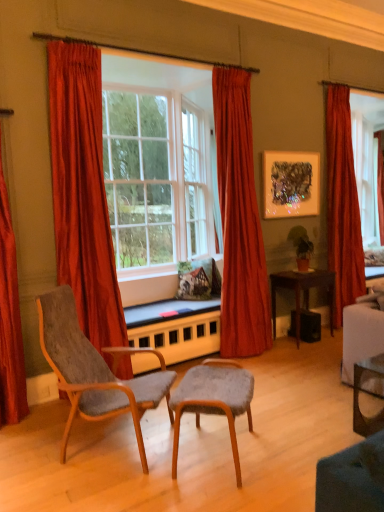
This screenshot has height=512, width=384. I want to click on clear glass window at center, so click(158, 163).

How much space does velvet red curtain at center, placed as the second curtain when sorted from right to left, occupy vertically?

9.21 feet.

Locate an element on the screen. velvet red curtain at left, the third curtain in the right-to-left sequence is located at coordinates (82, 192).

Measure the distance between velvet red curtain at left, the third curtain in the right-to-left sequence, and camera.

The distance of velvet red curtain at left, the third curtain in the right-to-left sequence, from camera is 3.09 meters.

This screenshot has width=384, height=512. What are the coordinates of `metallic textured artwork at upper right` in the screenshot? It's located at (291, 184).

How much space does satin red curtain at left, which ranks as the 1th curtain in left-to-right order, occupy vertically?

It is 7.36 feet.

Locate an element on the screen. Image resolution: width=384 pixels, height=512 pixels. green matte houseplant at upper right is located at coordinates (301, 246).

From their relative heights in the image, would you say velvet grey stool at center, placed as the 1th chair when sorted from right to left, is taller or shorter than velvet red curtain at left, the second curtain viewed from the left?

Clearly, velvet grey stool at center, placed as the 1th chair when sorted from right to left, is shorter compared to velvet red curtain at left, the second curtain viewed from the left.

Considering the relative sizes of velvet grey stool at center, arranged as the second chair when viewed from the left, and velvet red curtain at left, the second curtain viewed from the left, in the image provided, is velvet grey stool at center, arranged as the second chair when viewed from the left, thinner than velvet red curtain at left, the second curtain viewed from the left,?

No, velvet grey stool at center, arranged as the second chair when viewed from the left, is not thinner than velvet red curtain at left, the second curtain viewed from the left.

Does point (179, 383) come behind point (72, 147)?

No, it is in front of (72, 147).

Can we say velvet grey stool at center, arranged as the second chair when viewed from the left, lies outside velvet red curtain at left, the second curtain viewed from the left?

Yes.

Which is more to the right, velvet red curtain at left, the second curtain viewed from the left, or velvet grey stool at center, arranged as the second chair when viewed from the left?

From the viewer's perspective, velvet grey stool at center, arranged as the second chair when viewed from the left, appears more on the right side.

From a real-world perspective, who is located higher, velvet red curtain at left, the third curtain in the right-to-left sequence, or velvet grey stool at center, arranged as the second chair when viewed from the left?

velvet red curtain at left, the third curtain in the right-to-left sequence, is physically above.

In the scene shown: Is velvet red curtain at left, the third curtain in the right-to-left sequence, positioned beyond the bounds of velvet grey stool at center, placed as the 1th chair when sorted from right to left?

Yes, velvet red curtain at left, the third curtain in the right-to-left sequence, is outside of velvet grey stool at center, placed as the 1th chair when sorted from right to left.

Could you tell me if velvet red curtain at left, the third curtain in the right-to-left sequence, is turned towards velvet grey stool at center, arranged as the second chair when viewed from the left?

Yes, velvet red curtain at left, the third curtain in the right-to-left sequence, faces towards velvet grey stool at center, arranged as the second chair when viewed from the left.

Between velvet red curtain at center, arranged as the third curtain when viewed from the left, and velvet grey stool at center, arranged as the second chair when viewed from the left, which one is positioned behind?

velvet red curtain at center, arranged as the third curtain when viewed from the left.

Can you confirm if velvet red curtain at center, placed as the second curtain when sorted from right to left, is wider than velvet grey stool at center, arranged as the second chair when viewed from the left?

No, velvet red curtain at center, placed as the second curtain when sorted from right to left, is not wider than velvet grey stool at center, arranged as the second chair when viewed from the left.

Which is more to the left, velvet red curtain at center, arranged as the third curtain when viewed from the left, or velvet grey stool at center, arranged as the second chair when viewed from the left?

velvet grey stool at center, arranged as the second chair when viewed from the left.

Is there a large distance between velvet red curtain at center, placed as the second curtain when sorted from right to left, and velvet grey stool at center, arranged as the second chair when viewed from the left?

velvet red curtain at center, placed as the second curtain when sorted from right to left, is positioned a significant distance from velvet grey stool at center, arranged as the second chair when viewed from the left.

Is velvet red curtain at left, the third curtain in the right-to-left sequence, surrounded by velvet red curtain at right, which ranks as the fourth curtain in left-to-right order?

No, velvet red curtain at left, the third curtain in the right-to-left sequence, is not surrounded by velvet red curtain at right, which ranks as the fourth curtain in left-to-right order.

Can you confirm if velvet red curtain at right, which ranks as the fourth curtain in left-to-right order, is taller than velvet red curtain at left, the second curtain viewed from the left?

No, velvet red curtain at right, which ranks as the fourth curtain in left-to-right order, is not taller than velvet red curtain at left, the second curtain viewed from the left.

Is point (331, 226) behind point (69, 90)?

Yes, point (331, 226) is farther from viewer.

Find the location of a particular element. the 2nd curtain counting from the left side of the velvet red curtain at right, placed as the first curtain when sorted from right to left is located at coordinates (82, 192).

This screenshot has height=512, width=384. What are the coordinates of `the 2nd chair to the left when counting from the clear glass desk at lower right, the 2th desk viewed from the back` in the screenshot? It's located at (95, 370).

Who is taller, textured gray fabric chair at lower left, marked as the 2th chair in a right-to-left arrangement, or clear glass desk at lower right, acting as the 1th desk starting from the front?

With more height is textured gray fabric chair at lower left, marked as the 2th chair in a right-to-left arrangement.

From a real-world perspective, is textured gray fabric chair at lower left, marked as the 2th chair in a right-to-left arrangement, located higher than clear glass desk at lower right, the 2th desk viewed from the back?

Yes, from a real-world perspective, textured gray fabric chair at lower left, marked as the 2th chair in a right-to-left arrangement, is over clear glass desk at lower right, the 2th desk viewed from the back

Can you confirm if textured gray fabric chair at lower left, marked as the 2th chair in a right-to-left arrangement, is wider than clear glass desk at lower right, acting as the 1th desk starting from the front?

Yes.

Is textured gray fabric chair at lower left, which ranks as the first chair in left-to-right order, turned away from velvet red curtain at left, the second curtain viewed from the left?

textured gray fabric chair at lower left, which ranks as the first chair in left-to-right order, is not turned away from velvet red curtain at left, the second curtain viewed from the left.

Does textured gray fabric chair at lower left, which ranks as the first chair in left-to-right order, have a greater width compared to velvet red curtain at left, the second curtain viewed from the left?

Yes, textured gray fabric chair at lower left, which ranks as the first chair in left-to-right order, is wider than velvet red curtain at left, the second curtain viewed from the left.

Considering the sizes of objects textured gray fabric chair at lower left, which ranks as the first chair in left-to-right order, and velvet red curtain at left, the third curtain in the right-to-left sequence, in the image provided, who is shorter, textured gray fabric chair at lower left, which ranks as the first chair in left-to-right order, or velvet red curtain at left, the third curtain in the right-to-left sequence,?

With less height is textured gray fabric chair at lower left, which ranks as the first chair in left-to-right order.

Is velvet grey stool at center, arranged as the second chair when viewed from the left, outside of textured gray fabric chair at lower left, which ranks as the first chair in left-to-right order?

velvet grey stool at center, arranged as the second chair when viewed from the left, lies outside textured gray fabric chair at lower left, which ranks as the first chair in left-to-right order,'s area.

Based on the photo, is velvet grey stool at center, placed as the 1th chair when sorted from right to left, wider than textured gray fabric chair at lower left, marked as the 2th chair in a right-to-left arrangement?

No, velvet grey stool at center, placed as the 1th chair when sorted from right to left, is not wider than textured gray fabric chair at lower left, marked as the 2th chair in a right-to-left arrangement.

Are velvet grey stool at center, placed as the 1th chair when sorted from right to left, and textured gray fabric chair at lower left, marked as the 2th chair in a right-to-left arrangement, far apart?

Actually, velvet grey stool at center, placed as the 1th chair when sorted from right to left, and textured gray fabric chair at lower left, marked as the 2th chair in a right-to-left arrangement, are a little close together.

From a real-world perspective, relative to textured gray fabric chair at lower left, which ranks as the first chair in left-to-right order, is velvet grey stool at center, placed as the 1th chair when sorted from right to left, vertically above or below?

velvet grey stool at center, placed as the 1th chair when sorted from right to left, is situated lower than textured gray fabric chair at lower left, which ranks as the first chair in left-to-right order, in the real world.

From a real-world perspective, starting from the velvet red curtain at left, the second curtain viewed from the left, which chair is the 2nd one below it? Please provide its 2D coordinates.

[(213, 400)]

At what (x,y) coordinates should I click in order to perform the action: click on the 2nd curtain directly above the velvet grey stool at center, arranged as the second chair when viewed from the left (from a real-world perspective). Please return your answer as a coordinate pair (x, y). Looking at the image, I should click on (82, 192).

Looking at the image, which one is located closer to clear glass window at center, velvet red curtain at left, the second curtain viewed from the left, or velvet red curtain at right, which ranks as the fourth curtain in left-to-right order?

The object closer to clear glass window at center is velvet red curtain at left, the second curtain viewed from the left.

Considering their positions, is velvet red curtain at right, which ranks as the fourth curtain in left-to-right order, positioned closer to velvet red curtain at center, placed as the second curtain when sorted from right to left, than velvet grey stool at center, placed as the 1th chair when sorted from right to left?

Based on the image, velvet red curtain at right, which ranks as the fourth curtain in left-to-right order, appears to be nearer to velvet red curtain at center, placed as the second curtain when sorted from right to left.

Which object lies further to the anchor point wooden desk at lower right, which is the first desk in back-to-front order, clear glass window at center or satin red curtain at left, the fourth curtain when ordered from right to left?

satin red curtain at left, the fourth curtain when ordered from right to left, is further to wooden desk at lower right, which is the first desk in back-to-front order.

Looking at the image, which one is located further to velvet red curtain at center, arranged as the third curtain when viewed from the left, clear glass desk at lower right, acting as the 1th desk starting from the front, or velvet grey stool at center, placed as the 1th chair when sorted from right to left?

velvet grey stool at center, placed as the 1th chair when sorted from right to left.

Which object lies further to the anchor point clear glass window at center, green matte houseplant at upper right or velvet red curtain at center, arranged as the third curtain when viewed from the left?

green matte houseplant at upper right is further to clear glass window at center.

When comparing their distances from velvet red curtain at left, the second curtain viewed from the left, does metallic textured artwork at upper right or velvet grey stool at center, placed as the 1th chair when sorted from right to left, seem further?

Among the two, metallic textured artwork at upper right is located further to velvet red curtain at left, the second curtain viewed from the left.

Which object lies nearer to the anchor point metallic textured artwork at upper right, velvet red curtain at center, arranged as the third curtain when viewed from the left, or satin red curtain at left, which ranks as the 1th curtain in left-to-right order?

Based on the image, velvet red curtain at center, arranged as the third curtain when viewed from the left, appears to be nearer to metallic textured artwork at upper right.

Considering their positions, is wooden desk at lower right, which is the first desk in back-to-front order, positioned further to metallic textured artwork at upper right than green matte houseplant at upper right?

Based on the image, wooden desk at lower right, which is the first desk in back-to-front order, appears to be further to metallic textured artwork at upper right.

At what (x,y) coordinates should I click in order to perform the action: click on picture frame between velvet red curtain at left, the second curtain viewed from the left, and velvet red curtain at right, which ranks as the fourth curtain in left-to-right order, in the horizontal direction. Please return your answer as a coordinate pair (x, y). The height and width of the screenshot is (512, 384). Looking at the image, I should click on (291, 184).

I want to click on curtain between velvet red curtain at left, the third curtain in the right-to-left sequence, and velvet red curtain at right, placed as the first curtain when sorted from right to left, in the horizontal direction, so click(239, 221).

Image resolution: width=384 pixels, height=512 pixels. Find the location of `houseplant between velvet red curtain at right, placed as the first curtain when sorted from right to left, and wooden desk at lower right, which is the first desk in back-to-front order, in the up-down direction`. houseplant between velvet red curtain at right, placed as the first curtain when sorted from right to left, and wooden desk at lower right, which is the first desk in back-to-front order, in the up-down direction is located at coordinates (301, 246).

Find the location of a particular element. houseplant between satin red curtain at left, which ranks as the 1th curtain in left-to-right order, and clear glass desk at lower right, acting as the 1th desk starting from the front, from left to right is located at coordinates (301, 246).